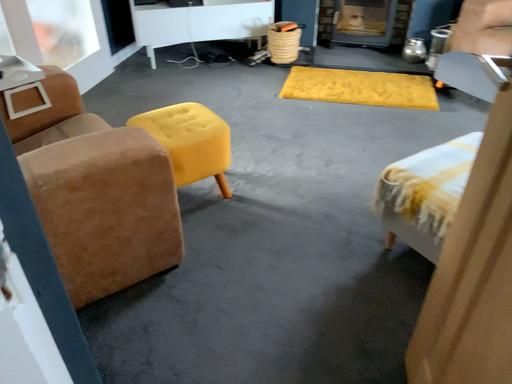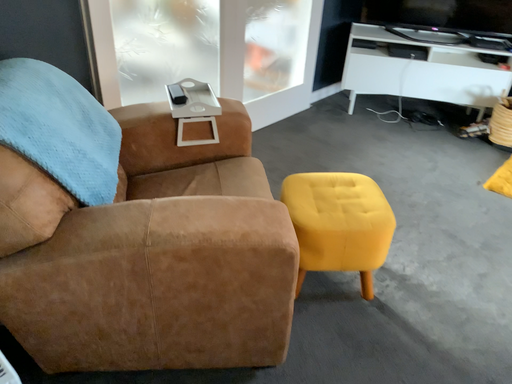
Question: Which way did the camera rotate in the video?

Choices:
 (A) rotated upward
 (B) rotated downward

Answer: (A)